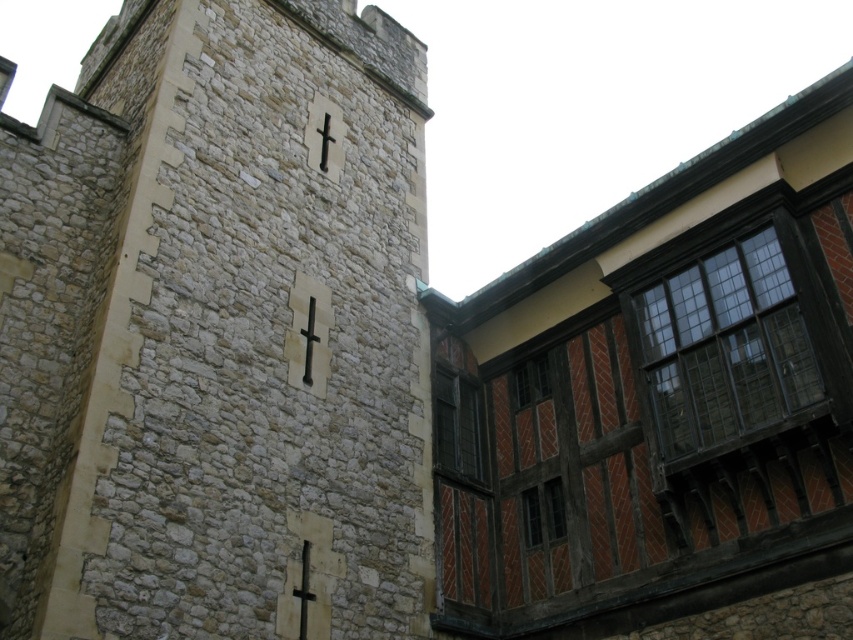
Question: Does dark wood window at right have a larger size compared to matte wooden window at center?

Choices:
 (A) yes
 (B) no

Answer: (A)

Question: Which point is closer to the camera?

Choices:
 (A) dark wood window at right
 (B) wooden-framed window at lower right
 (C) matte wooden window at center

Answer: (A)

Question: Can you confirm if dark wood window at right is positioned to the right of wooden-framed window at lower right?

Choices:
 (A) yes
 (B) no

Answer: (A)

Question: Does matte wooden window at center appear on the right side of wooden-framed glass window at center-right?

Choices:
 (A) yes
 (B) no

Answer: (B)

Question: Among these objects, which one is nearest to the camera?

Choices:
 (A) matte wooden window at center
 (B) dark wood window at right

Answer: (B)

Question: Considering the real-world distances, which object is closest to the wooden-framed glass window at center-right?

Choices:
 (A) dark wood window at right
 (B) matte wooden window at center
 (C) wooden-framed window at lower right

Answer: (B)